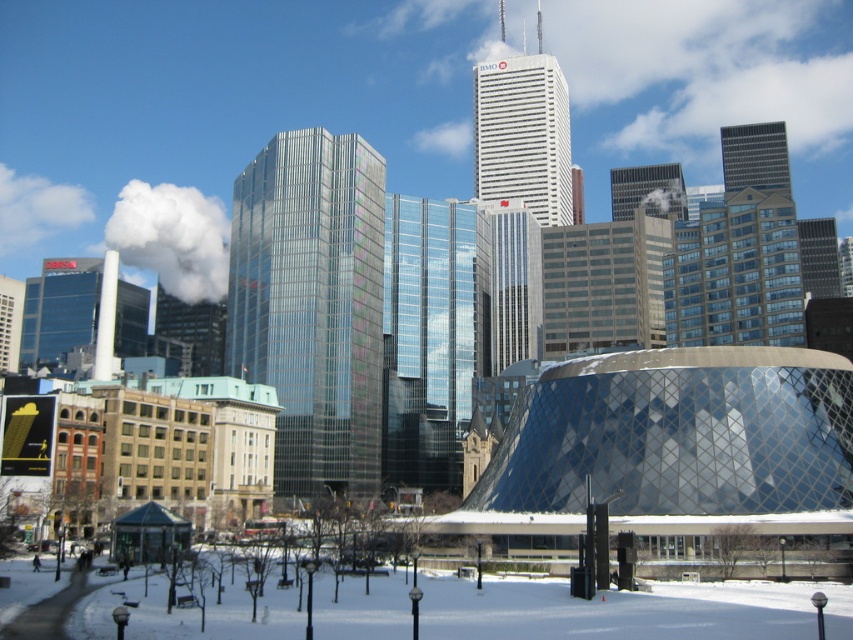
Question: Does shiny glass skyscraper at center appear on the left side of glassy reflective skyscraper at upper right?

Choices:
 (A) yes
 (B) no

Answer: (A)

Question: Is white glass skyscraper at center closer to the viewer compared to glassy reflective skyscraper at upper right?

Choices:
 (A) yes
 (B) no

Answer: (B)

Question: Which object appears closest to the camera in this image?

Choices:
 (A) white glass skyscraper at center
 (B) matte glass building at upper center

Answer: (B)

Question: Which point is closer to the camera taking this photo?

Choices:
 (A) (366, 356)
 (B) (772, 145)

Answer: (A)

Question: Which point is closer to the camera?

Choices:
 (A) (653, 173)
 (B) (351, 454)

Answer: (B)

Question: Is shiny glass skyscraper at center further to camera compared to white glass skyscraper at center?

Choices:
 (A) yes
 (B) no

Answer: (B)